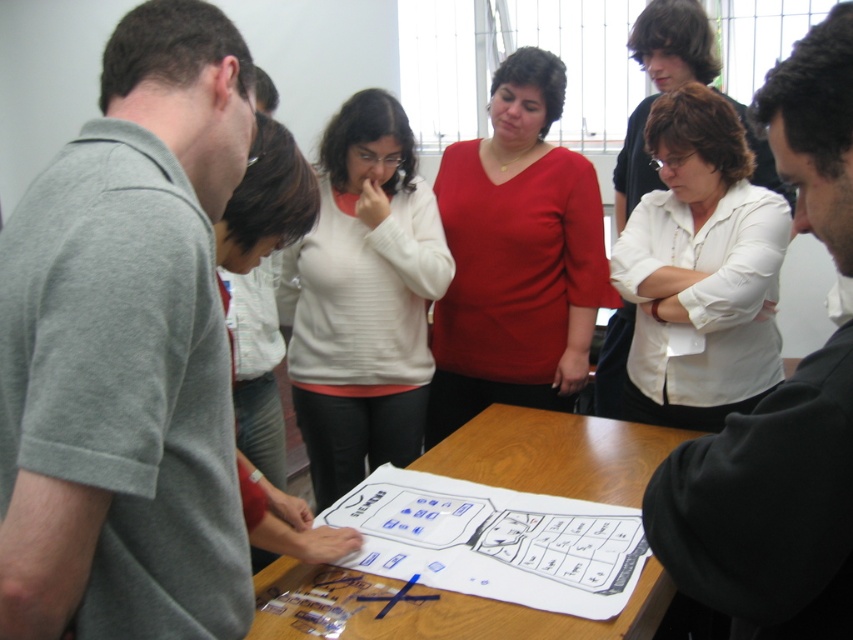
You are part of the group at the table and want to hand a document to both the gray cotton shirt at left and the red matte shirt at center. Which person should you approach first to ensure you can reach them without obstructing the view of the diagram?

You should approach the gray cotton shirt at left first because they are closer to you, so you can reach them without needing to move further back, which might block the view of the diagram for others.

You are an observer in the room. You notice two people at the center of the table wearing black matte shirt at center and red matte shirt at center. Which person is wearing a smaller shirt?

The black matte shirt at center is smaller than the red matte shirt at center, so the person wearing the black matte shirt at center has the smaller shirt.